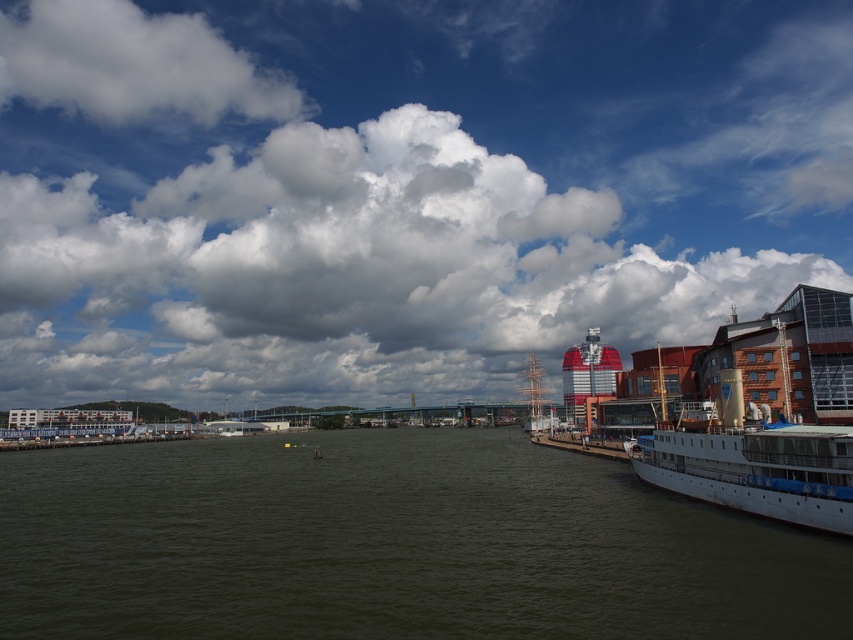
Does white fluffy cloud at upper left appear on the right side of wooden dock at center?

In fact, white fluffy cloud at upper left is to the left of wooden dock at center.

Is point (119, 32) behind point (543, 444)?

Yes.

This screenshot has width=853, height=640. I want to click on white fluffy cloud at upper left, so click(132, 65).

Can you confirm if white fluffy cloud at upper center is positioned below wooden dock at center?

No.

This screenshot has width=853, height=640. I want to click on white fluffy cloud at upper center, so click(402, 189).

Is the position of greenish-brown water at center more distant than that of wooden dock at center?

No, it is not.

Is point (410, 432) positioned behind point (566, 438)?

Yes, it is behind point (566, 438).

Who is more distant from viewer, (x=386, y=476) or (x=614, y=451)?

Positioned behind is point (x=614, y=451).

This screenshot has height=640, width=853. I want to click on greenish-brown water at center, so click(392, 545).